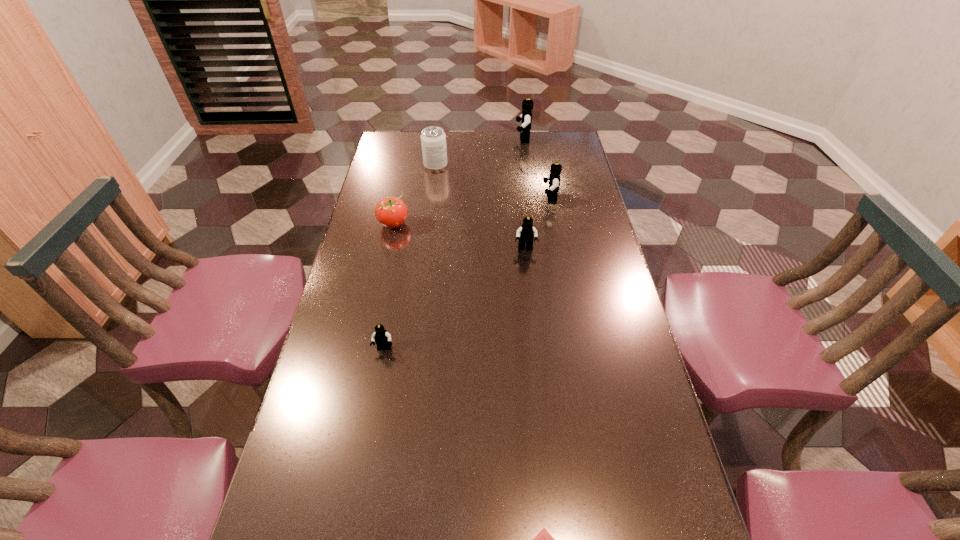
Where is `vacant region at the far right corner of the desktop`? The width and height of the screenshot is (960, 540). vacant region at the far right corner of the desktop is located at coordinates (564, 143).

The width and height of the screenshot is (960, 540). In order to click on free point between the second biggest black Lego and the fourth nearest object in this screenshot , I will do `click(472, 211)`.

Image resolution: width=960 pixels, height=540 pixels. What are the coordinates of `vacant area that lies between the leftmost black Lego and the second farthest object` in the screenshot? It's located at (410, 257).

Locate an element on the screen. vacant area between the third farthest black Lego and the second shortest object is located at coordinates (455, 299).

What are the coordinates of `free space between the farthest black Lego and the fourth farthest object` in the screenshot? It's located at (459, 181).

Where is `vacant space in between the sixth tallest object and the tomato`? This screenshot has width=960, height=540. vacant space in between the sixth tallest object and the tomato is located at coordinates (389, 286).

You are a GUI agent. You are given a task and a screenshot of the screen. Output one action in this format:
    pyautogui.click(x=<x>, y=<y>)
    Task: Click on the object that is the third closest to the smallest black Lego
    
    Given the screenshot: What is the action you would take?
    pyautogui.click(x=543, y=539)

Identify which object is the third nearest to the tallest object. Please provide its 2D coordinates. Your answer should be formatted as a tuple, i.e. [(x, y)], where the tuple contains the x and y coordinates of a point satisfying the conditions above.

[(391, 212)]

At what (x,y) coordinates should I click in order to perform the action: click on Lego that is the nearest to the shortest Lego. Please return your answer as a coordinate pair (x, y). This screenshot has width=960, height=540. Looking at the image, I should click on (382, 338).

Identify which Lego is the second nearest to the soda can. Please provide its 2D coordinates. Your answer should be formatted as a tuple, i.e. [(x, y)], where the tuple contains the x and y coordinates of a point satisfying the conditions above.

[(554, 178)]